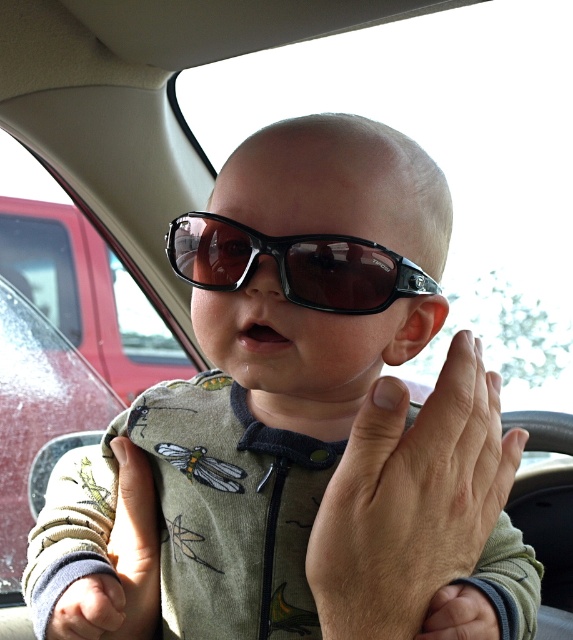
Does smooth skin hand at center appear over soft beige fabric hand at lower left?

Correct, smooth skin hand at center is located above soft beige fabric hand at lower left.

Who is more forward, (431, 401) or (139, 577)?

Positioned in front is point (431, 401).

The image size is (573, 640). Find the location of `smooth skin hand at center`. smooth skin hand at center is located at coordinates (414, 508).

Locate an element on the screen. The image size is (573, 640). matte black sunglasses at center is located at coordinates (300, 426).

Is matte black sunglasses at center to the right of soft beige fabric hand at lower left from the viewer's perspective?

Correct, you'll find matte black sunglasses at center to the right of soft beige fabric hand at lower left.

Who is more distant from viewer, (186, 540) or (129, 566)?

The point (129, 566) is behind.

At what (x,y) coordinates should I click in order to perform the action: click on matte black sunglasses at center. Please return your answer as a coordinate pair (x, y). Looking at the image, I should click on (300, 426).

Does matte black sunglasses at center appear over smooth skin hand at center?

Yes, matte black sunglasses at center is above smooth skin hand at center.

What are the coordinates of `matte black sunglasses at center` in the screenshot? It's located at (300, 426).